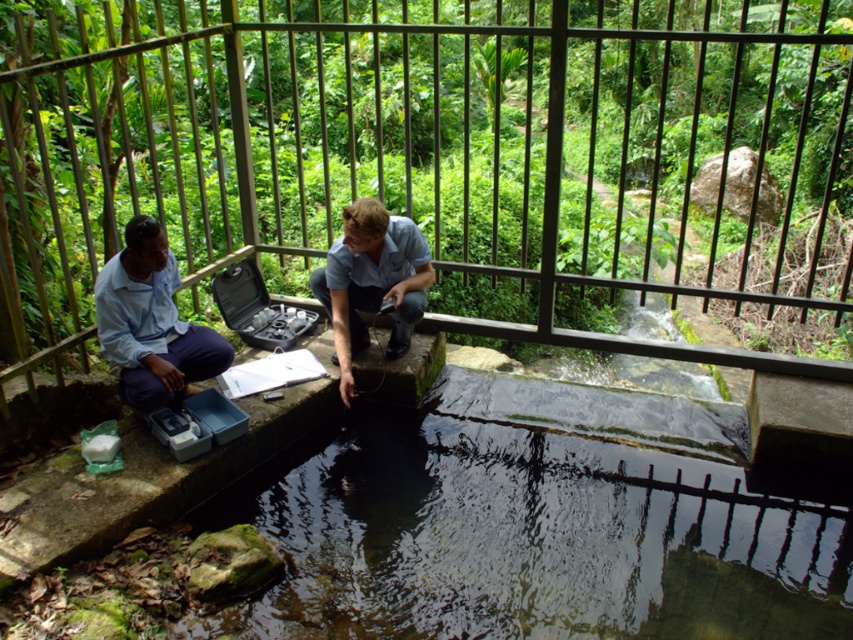
Question: Does light blue shirt at left have a lesser width compared to light blue shirt at center?

Choices:
 (A) no
 (B) yes

Answer: (B)

Question: Which object is closer to the camera taking this photo?

Choices:
 (A) light blue shirt at center
 (B) light blue shirt at left
 (C) blue cotton shirt at center
 (D) metal at center

Answer: (D)

Question: In this image, where is light blue shirt at left located relative to light blue shirt at center?

Choices:
 (A) above
 (B) below

Answer: (B)

Question: Among these points, which one is farthest from the camera?

Choices:
 (A) (154, 285)
 (B) (392, 332)
 (C) (357, 243)

Answer: (B)

Question: Is metal at center behind light blue shirt at center?

Choices:
 (A) no
 (B) yes

Answer: (A)

Question: Which point is closer to the camera?

Choices:
 (A) metal at center
 (B) blue cotton shirt at center
 (C) light blue shirt at center
 (D) light blue shirt at left

Answer: (A)